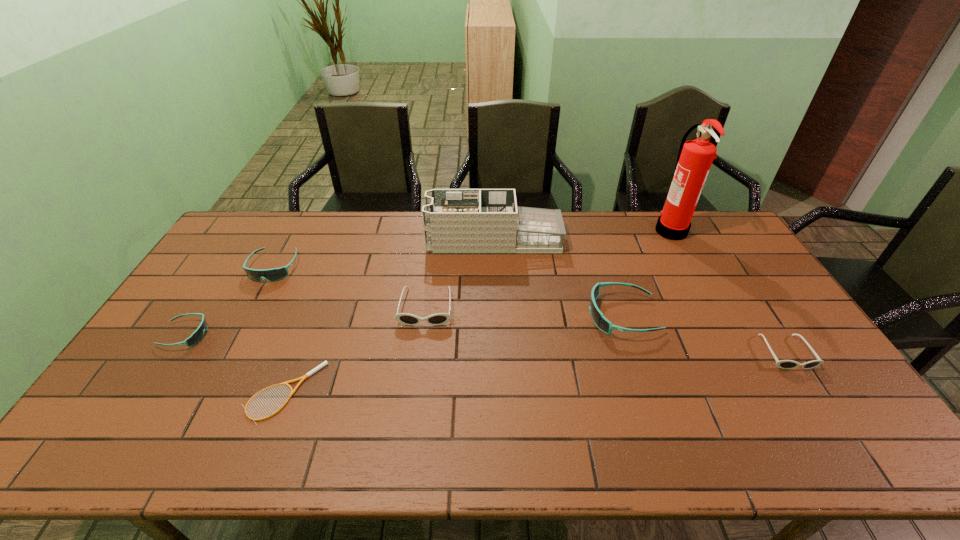
The width and height of the screenshot is (960, 540). I want to click on object that can be found as the fourth closest to the nearer black sunglasses, so click(436, 319).

You are a GUI agent. You are given a task and a screenshot of the screen. Output one action in this format:
    pyautogui.click(x=<x>, y=<y>)
    Task: Click on the sunglasses that is the second closest to the third sunglasses from right to left
    The image size is (960, 540).
    Given the screenshot: What is the action you would take?
    pyautogui.click(x=600, y=321)

Point out which sunglasses is positioned as the fourth nearest to the second biggest cyan sunglasses. Please provide its 2D coordinates. Your answer should be formatted as a tuple, i.e. [(x, y)], where the tuple contains the x and y coordinates of a point satisfying the conditions above.

[(783, 364)]

Select which cyan sunglasses appears as the closest to the bigger black sunglasses. Please provide its 2D coordinates. Your answer should be formatted as a tuple, i.e. [(x, y)], where the tuple contains the x and y coordinates of a point satisfying the conditions above.

[(274, 274)]

Identify which cyan sunglasses is the closest to the second cyan sunglasses from right to left. Please provide its 2D coordinates. Your answer should be formatted as a tuple, i.e. [(x, y)], where the tuple contains the x and y coordinates of a point satisfying the conditions above.

[(197, 336)]

Locate an element on the screen. free space that satisfies the following two spatial constraints: 1. with the lenses of the third sunglasses from right to left facing outward; 2. on the front-facing side of the smallest cyan sunglasses is located at coordinates (422, 335).

The width and height of the screenshot is (960, 540). In order to click on free space that satisfies the following two spatial constraints: 1. at the entrance of the second tallest object; 2. on the front-facing side of the second cyan sunglasses from left to right in this screenshot , I will do `click(495, 267)`.

Image resolution: width=960 pixels, height=540 pixels. I want to click on vacant space that satisfies the following two spatial constraints: 1. with the nozzle aimed from the fire extinguisher; 2. with the lenses of the left black sunglasses facing outward, so click(712, 307).